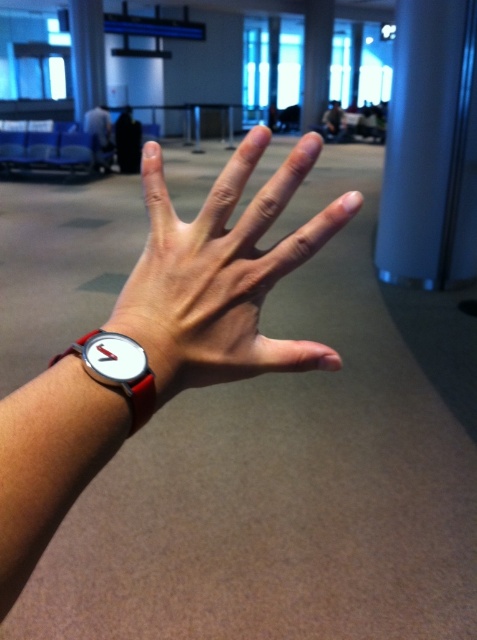
Question: Can you confirm if white leather watch at center is thinner than red leather watch at lower left?

Choices:
 (A) yes
 (B) no

Answer: (B)

Question: Is red leather watch at lower left bigger than matte black watch at lower left?

Choices:
 (A) yes
 (B) no

Answer: (B)

Question: Among these points, which one is nearest to the camera?

Choices:
 (A) (101, 125)
 (B) (244, 140)

Answer: (B)

Question: In this image, where is satin blue pillar at right located relative to red leather watch at lower left?

Choices:
 (A) below
 (B) above

Answer: (B)

Question: Which of these objects is positioned closest to the white leather watch at center?

Choices:
 (A) red leather watch at lower left
 (B) white matte watch at center
 (C) matte black watch at lower left
 (D) satin blue pillar at right

Answer: (B)

Question: Among these objects, which one is farthest from the camera?

Choices:
 (A) matte black watch at lower left
 (B) white matte watch at center
 (C) white leather watch at center
 (D) red leather watch at lower left

Answer: (A)